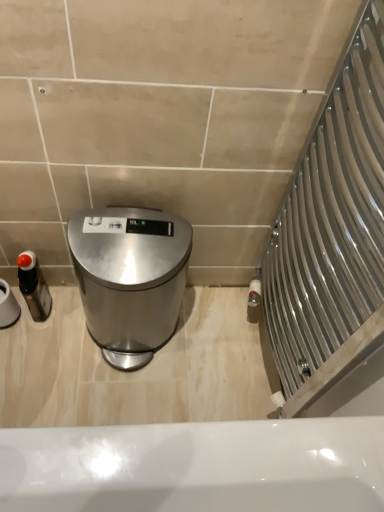
The height and width of the screenshot is (512, 384). I want to click on satin silver trash can at center, so click(130, 278).

The height and width of the screenshot is (512, 384). What do you see at coordinates (34, 286) in the screenshot? I see `matte black bottle at left` at bounding box center [34, 286].

This screenshot has height=512, width=384. Identify the location of white matte toilet paper at left. (8, 306).

How far apart are white matte toilet paper at left and satin silver trash can at center?

white matte toilet paper at left and satin silver trash can at center are 39.75 centimeters apart from each other.

Are white matte toilet paper at left and satin silver trash can at center located far from each other?

white matte toilet paper at left is actually quite close to satin silver trash can at center.

Can you confirm if white matte toilet paper at left is positioned to the right of satin silver trash can at center?

No.

In terms of height, does white matte toilet paper at left look taller or shorter compared to satin silver trash can at center?

Clearly, white matte toilet paper at left is shorter compared to satin silver trash can at center.

Does matte black bottle at left have a smaller size compared to white matte toilet paper at left?

Yes, matte black bottle at left is smaller than white matte toilet paper at left.

Considering the sizes of objects matte black bottle at left and white matte toilet paper at left in the image provided, who is shorter, matte black bottle at left or white matte toilet paper at left?

matte black bottle at left is shorter.

Which of these two, matte black bottle at left or white matte toilet paper at left, is wider?

Wider between the two is white matte toilet paper at left.

From the image's perspective, which one is positioned lower, matte black bottle at left or white matte toilet paper at left?

matte black bottle at left is shown below in the image.

Is white matte toilet paper at left in contact with matte black bottle at left?

Yes, the surface of white matte toilet paper at left is in contact with matte black bottle at left.

Would you say white matte toilet paper at left contains matte black bottle at left?

Definitely not — matte black bottle at left is not inside white matte toilet paper at left.

From the picture: Which is farther from the camera, (x=9, y=304) or (x=27, y=255)?

The point (x=9, y=304) is farther.

Based on the photo, is white matte toilet paper at left to the right of matte black bottle at left from the viewer's perspective?

Incorrect, white matte toilet paper at left is not on the right side of matte black bottle at left.

Can we say satin silver trash can at center lies outside white matte toilet paper at left?

Indeed, satin silver trash can at center is completely outside white matte toilet paper at left.

Considering the relative sizes of satin silver trash can at center and white matte toilet paper at left in the image provided, is satin silver trash can at center smaller than white matte toilet paper at left?

No, satin silver trash can at center is not smaller than white matte toilet paper at left.

Locate an element on the screen. The image size is (384, 512). waste container in front of the white matte toilet paper at left is located at coordinates (130, 278).

How far apart are satin silver trash can at center and matte black bottle at left?

satin silver trash can at center is 10.71 inches from matte black bottle at left.

Considering the positions of objects satin silver trash can at center and matte black bottle at left in the image provided, who is more to the right, satin silver trash can at center or matte black bottle at left?

From the viewer's perspective, satin silver trash can at center appears more on the right side.

Is satin silver trash can at center wider than matte black bottle at left?

Correct, the width of satin silver trash can at center exceeds that of matte black bottle at left.

Can you tell me how much satin silver trash can at center and matte black bottle at left differ in facing direction?

They differ by 7.74 degrees in their facing directions.

From the image's perspective, is matte black bottle at left above or below satin silver trash can at center?

Clearly, from the image's perspective, matte black bottle at left is above satin silver trash can at center.

Which object is further away from the camera taking this photo, matte black bottle at left or satin silver trash can at center?

matte black bottle at left is further away from the camera.

Can you confirm if matte black bottle at left is wider than satin silver trash can at center?

No, matte black bottle at left is not wider than satin silver trash can at center.

Can you confirm if matte black bottle at left is smaller than satin silver trash can at center?

Correct, matte black bottle at left occupies less space than satin silver trash can at center.

Where is `waste container above the white matte toilet paper at left (from a real-world perspective)`? The height and width of the screenshot is (512, 384). waste container above the white matte toilet paper at left (from a real-world perspective) is located at coordinates (130, 278).

This screenshot has height=512, width=384. In order to click on bottle behind the white matte toilet paper at left in this screenshot , I will do `click(34, 286)`.

When comparing their distances from matte black bottle at left, does white matte toilet paper at left or satin silver trash can at center seem closer?

white matte toilet paper at left.

Consider the image. Considering their positions, is satin silver trash can at center positioned closer to matte black bottle at left than white matte toilet paper at left?

Based on the image, white matte toilet paper at left appears to be nearer to matte black bottle at left.

From the image, which object appears to be nearer to white matte toilet paper at left, satin silver trash can at center or matte black bottle at left?

matte black bottle at left is closer to white matte toilet paper at left.

Which object lies nearer to the anchor point white matte toilet paper at left, matte black bottle at left or satin silver trash can at center?

matte black bottle at left.

From the image, which object appears to be farther from satin silver trash can at center, matte black bottle at left or white matte toilet paper at left?

white matte toilet paper at left lies further to satin silver trash can at center than the other object.

Considering their positions, is white matte toilet paper at left positioned further to satin silver trash can at center than matte black bottle at left?

white matte toilet paper at left is further to satin silver trash can at center.

The image size is (384, 512). I want to click on bottle between white matte toilet paper at left and satin silver trash can at center in the horizontal direction, so point(34,286).